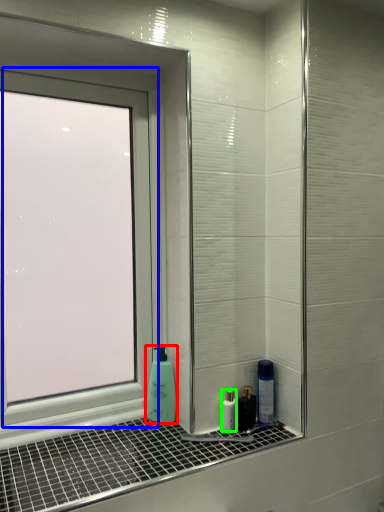
Question: Based on their relative distances, which object is farther from soap dispenser (highlighted by a red box)? Choose from window (highlighted by a blue box) and mouthwash (highlighted by a green box).

Choices:
 (A) window
 (B) mouthwash

Answer: (A)